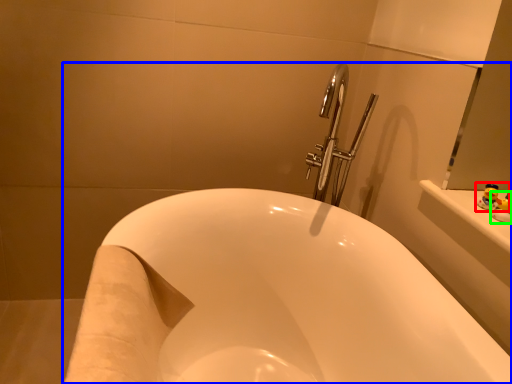
Question: Based on their relative distances, which object is farther from toy (highlighted by a red box)? Choose from bathtub (highlighted by a blue box) and toy (highlighted by a green box).

Choices:
 (A) bathtub
 (B) toy

Answer: (A)